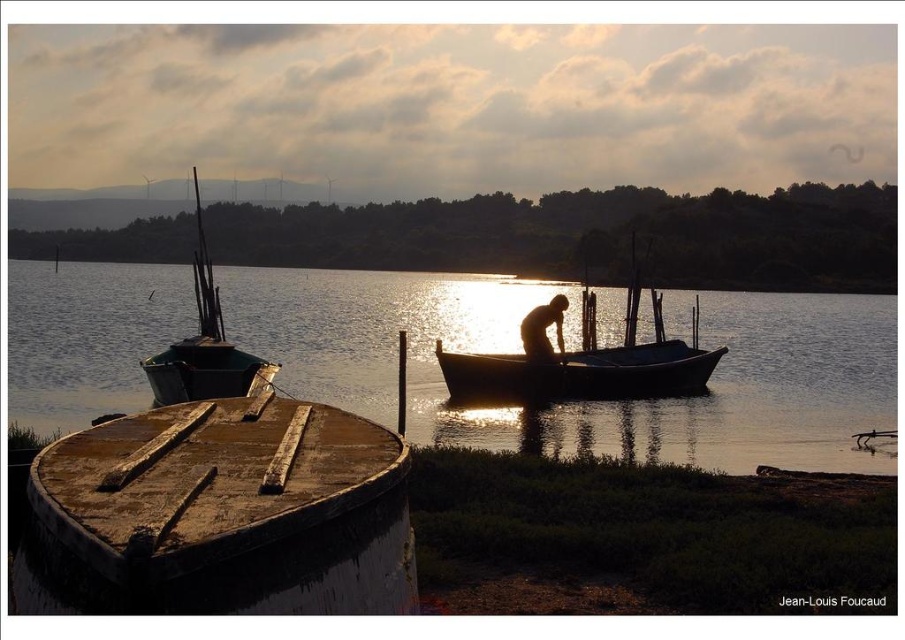
Question: Is smooth water at boat right to the right of silhouette human at center from the viewer's perspective?

Choices:
 (A) no
 (B) yes

Answer: (A)

Question: Estimate the real-world distances between objects in this image. Which object is closer to the smooth water at boat right?

Choices:
 (A) green wooden boat at left
 (B) smooth wooden canoe at center

Answer: (B)

Question: Can you confirm if wooden boat at center is positioned to the left of silhouette human at center?

Choices:
 (A) yes
 (B) no

Answer: (B)

Question: Can you confirm if smooth wooden canoe at center is thinner than green wooden boat at left?

Choices:
 (A) no
 (B) yes

Answer: (B)

Question: Which point is closer to the camera taking this photo?

Choices:
 (A) (694, 362)
 (B) (543, 346)

Answer: (B)

Question: Which point appears closest to the camera in this image?

Choices:
 (A) (500, 365)
 (B) (563, 352)
 (C) (731, 412)
 (D) (235, 376)

Answer: (D)